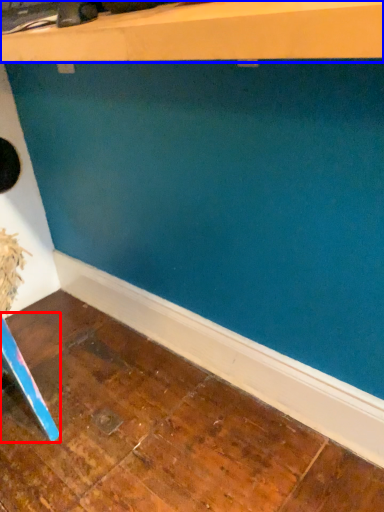
Question: Among these objects, which one is farthest to the camera, furniture (highlighted by a red box) or shelf (highlighted by a blue box)?

Choices:
 (A) furniture
 (B) shelf

Answer: (A)